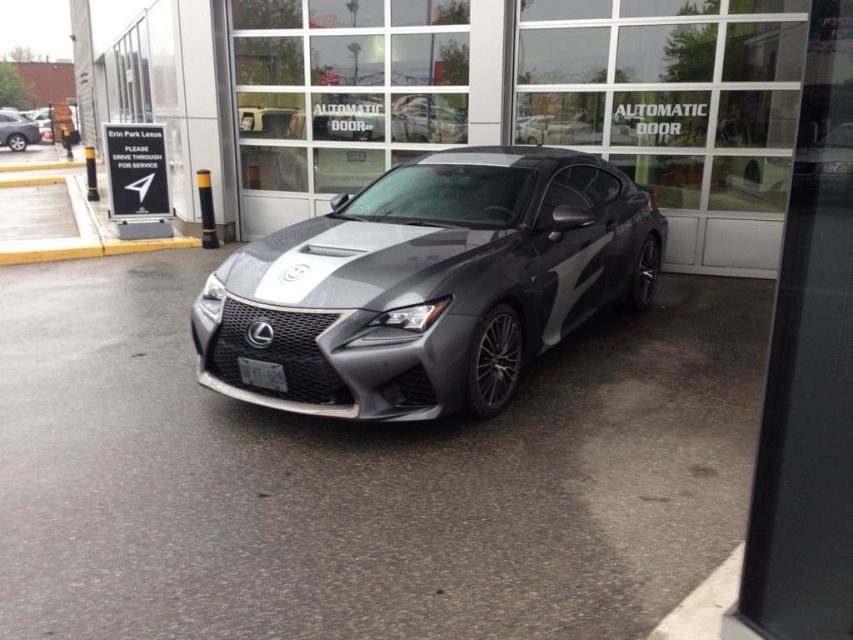
You are a customer at Erin Park Lexus dealership and want to inspect the satin metallic sedan at center. However, it is currently blocked by the matte black car at left. Can you access the sedan directly from its current position?

The satin metallic sedan at center is positioned under the matte black car at left, meaning the matte black car is blocking direct access to the sedan. You would need to move the matte black car at left to access the satin metallic sedan at center.

You are standing in front of the dealership and want to take a closer look at the cars. Which car, the glossy metallic car at center or the satin metallic sedan at center, would you need to walk towards first to examine its front grille?

The glossy metallic car at center is closer to you than the satin metallic sedan at center, so you should walk towards the glossy metallic car at center first to examine its front grille.